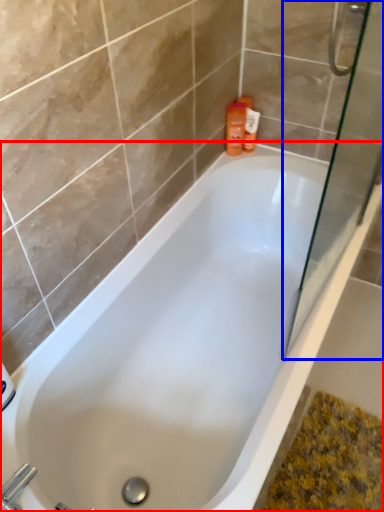
Question: Which point is closer to the camera, bathtub (highlighted by a red box) or screen door (highlighted by a blue box)?

Choices:
 (A) bathtub
 (B) screen door

Answer: (B)